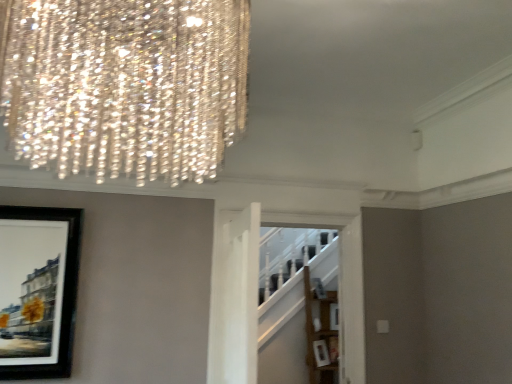
Question: From a real-world perspective, does wooden shelf at center sit lower than black matte picture frame at left?

Choices:
 (A) yes
 (B) no

Answer: (A)

Question: From the image's perspective, is wooden shelf at center located beneath black matte picture frame at left?

Choices:
 (A) yes
 (B) no

Answer: (A)

Question: Is black matte picture frame at left inside wooden shelf at center?

Choices:
 (A) yes
 (B) no

Answer: (B)

Question: Can you confirm if wooden shelf at center is thinner than black matte picture frame at left?

Choices:
 (A) yes
 (B) no

Answer: (B)

Question: Can you confirm if wooden shelf at center is positioned to the right of black matte picture frame at left?

Choices:
 (A) no
 (B) yes

Answer: (B)

Question: From a real-world perspective, does wooden shelf at center stand above black matte picture frame at left?

Choices:
 (A) no
 (B) yes

Answer: (A)

Question: Does black matte picture frame at left have a lesser width compared to wooden shelf at center?

Choices:
 (A) no
 (B) yes

Answer: (B)

Question: Considering the relative sizes of black matte picture frame at left and wooden shelf at center in the image provided, is black matte picture frame at left bigger than wooden shelf at center?

Choices:
 (A) yes
 (B) no

Answer: (B)

Question: Does black matte picture frame at left have a greater width compared to wooden shelf at center?

Choices:
 (A) no
 (B) yes

Answer: (A)

Question: From the image's perspective, is black matte picture frame at left beneath wooden shelf at center?

Choices:
 (A) yes
 (B) no

Answer: (B)

Question: From a real-world perspective, is black matte picture frame at left positioned under wooden shelf at center based on gravity?

Choices:
 (A) no
 (B) yes

Answer: (A)

Question: Can you confirm if black matte picture frame at left is positioned to the right of wooden shelf at center?

Choices:
 (A) yes
 (B) no

Answer: (B)

Question: Considering the positions of wooden shelf at center and black matte picture frame at left in the image, is wooden shelf at center taller or shorter than black matte picture frame at left?

Choices:
 (A) tall
 (B) short

Answer: (A)